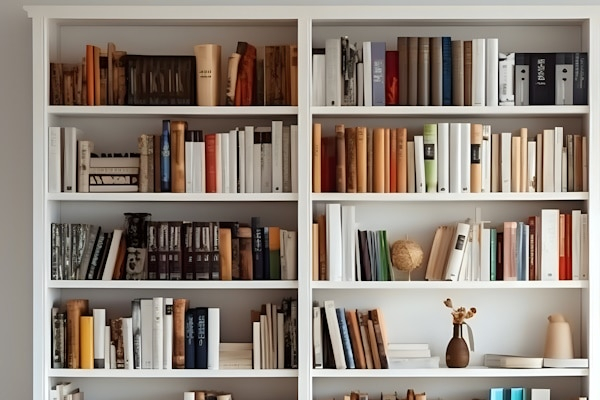
Where is `shelves`? shelves is located at coordinates (457, 372), (439, 285), (429, 197), (416, 107), (238, 111), (217, 198), (192, 284), (238, 367).